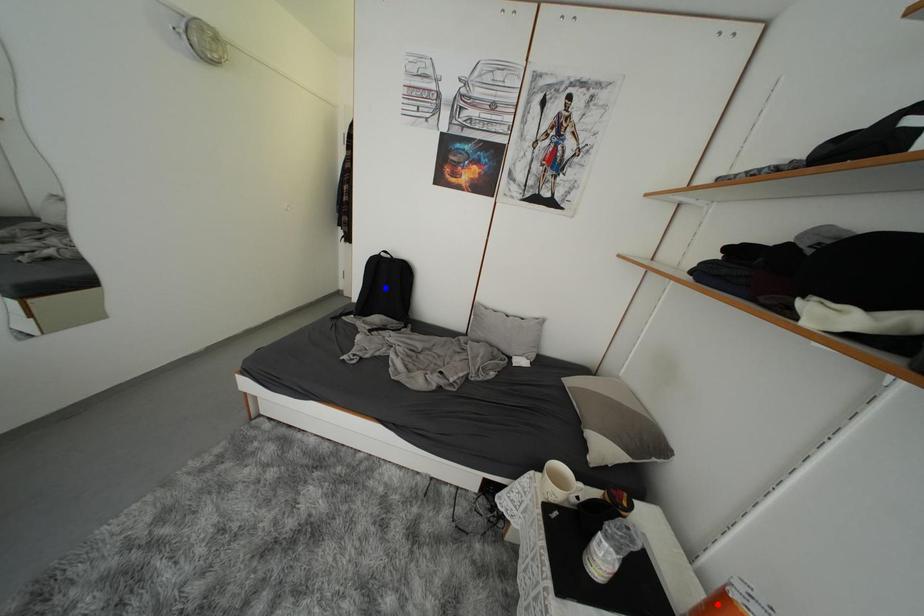
Question: Two points are marked on the image. Which point is closer to the camera?

Choices:
 (A) Blue point is closer.
 (B) Red point is closer.

Answer: (B)